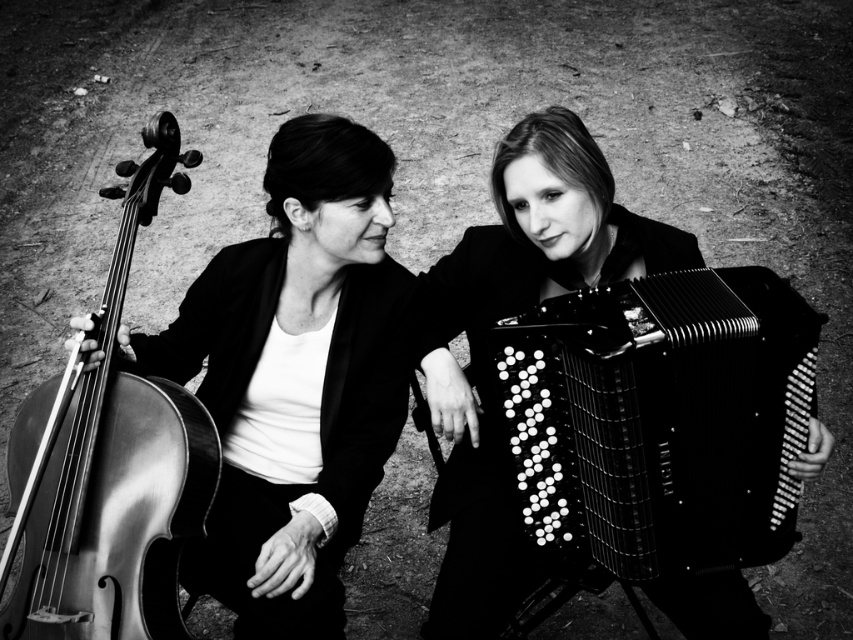
Question: Which point is closer to the camera?

Choices:
 (A) (785, 476)
 (B) (39, 390)
 (C) (402, 317)

Answer: (A)

Question: Does black matte accordion at center have a lesser width compared to shiny wood violin at left?

Choices:
 (A) no
 (B) yes

Answer: (A)

Question: Which point is closer to the camera taking this photo?

Choices:
 (A) (367, 378)
 (B) (73, 403)

Answer: (B)

Question: Among these points, which one is farthest from the camera?

Choices:
 (A) (341, 460)
 (B) (103, 573)
 (C) (792, 385)

Answer: (A)

Question: Does shiny black cello at left appear on the right side of shiny wood violin at left?

Choices:
 (A) no
 (B) yes

Answer: (B)

Question: Is shiny black cello at left positioned behind black matte accordion at center?

Choices:
 (A) no
 (B) yes

Answer: (B)